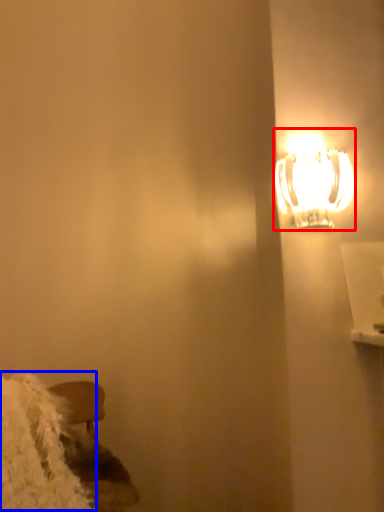
Question: Among these objects, which one is nearest to the camera, lamp (highlighted by a red box) or wide (highlighted by a blue box)?

Choices:
 (A) lamp
 (B) wide

Answer: (B)